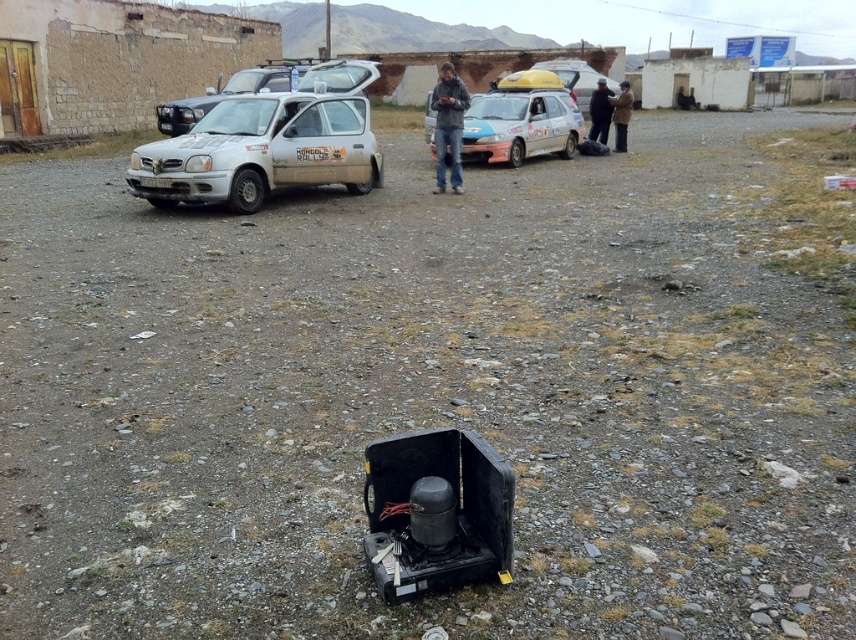
From the picture: You are a hiker who has just arrived at this desert location. You see a dark blue fabric jacket at upper center. Where exactly is the dark blue fabric jacket located in terms of coordinates?

The dark blue fabric jacket at upper center is located at point (599, 112).

You are a hiker trying to decide which jacket to take from the two jackets at upper center. The dark blue fabric jacket at upper center is in front of the brown leather jacket at upper center. Which jacket is more accessible to you?

The dark blue fabric jacket at upper center is more accessible because it is in front of the brown leather jacket at upper center.